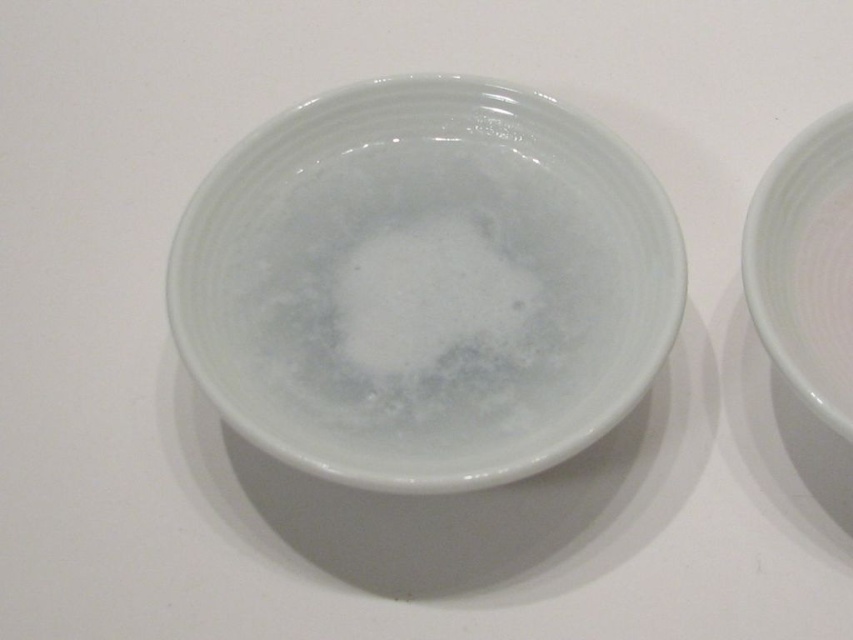
Question: Which of these objects is positioned closest to the white frothy foam at center?

Choices:
 (A) glossy ceramic bowl at center
 (B) white glossy bowl at right

Answer: (A)

Question: Which point appears farthest from the camera in this image?

Choices:
 (A) (795, 364)
 (B) (326, 125)
 (C) (471, 291)

Answer: (B)

Question: Is the position of white frothy foam at center more distant than that of white glossy bowl at right?

Choices:
 (A) yes
 (B) no

Answer: (A)

Question: Which of the following is the farthest from the observer?

Choices:
 (A) glossy ceramic bowl at center
 (B) white glossy bowl at right
 (C) white frothy foam at center

Answer: (C)

Question: Is white frothy foam at center above white glossy bowl at right?

Choices:
 (A) yes
 (B) no

Answer: (B)

Question: Does glossy ceramic bowl at center have a smaller size compared to white glossy bowl at right?

Choices:
 (A) yes
 (B) no

Answer: (B)